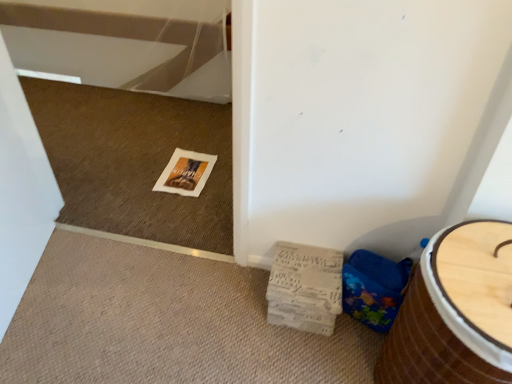
Question: Is blue fabric potty at lower right taller or shorter than wooden barrel at lower right?

Choices:
 (A) short
 (B) tall

Answer: (A)

Question: From a real-world perspective, is blue fabric potty at lower right above or below wooden barrel at lower right?

Choices:
 (A) above
 (B) below

Answer: (B)

Question: Which is farther from the wooden barrel at lower right?

Choices:
 (A) blue fabric potty at lower right
 (B) white cardboard magazine at lower right

Answer: (B)

Question: Based on their relative distances, which object is farther from the wooden barrel at lower right?

Choices:
 (A) blue fabric potty at lower right
 (B) white cardboard magazine at lower right

Answer: (B)